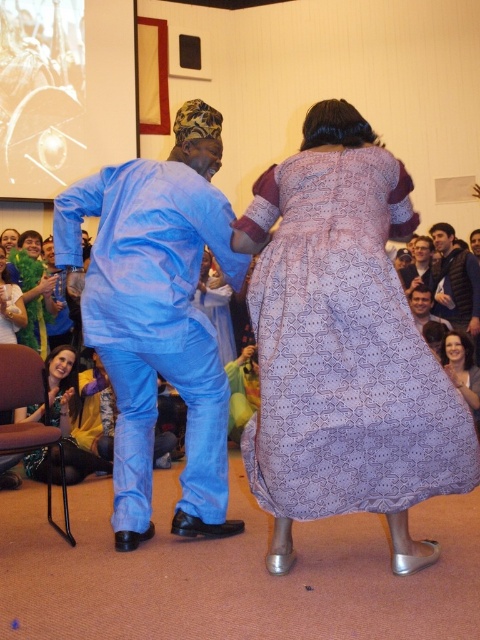
Question: Which object is closer to the camera taking this photo?

Choices:
 (A) blue cotton outfit at center
 (B) dark blue vest at upper right
 (C) matte blue suit at center

Answer: (A)

Question: Considering the relative positions of matte green dress at lower left and smooth skin face at center in the image provided, where is matte green dress at lower left located with respect to smooth skin face at center?

Choices:
 (A) below
 (B) above

Answer: (B)

Question: Does matte green dress at lower left appear over matte blue suit at center?

Choices:
 (A) no
 (B) yes

Answer: (A)

Question: Which point is closer to the camera?

Choices:
 (A) (406, 284)
 (B) (410, 301)
 (C) (440, 241)

Answer: (B)

Question: Is dark blue vest at upper right to the right of matte blue suit at center from the viewer's perspective?

Choices:
 (A) no
 (B) yes

Answer: (B)

Question: Which object is farther from the camera taking this photo?

Choices:
 (A) purple textured dress at center
 (B) matte green dress at lower left
 (C) smooth skin face at center

Answer: (C)